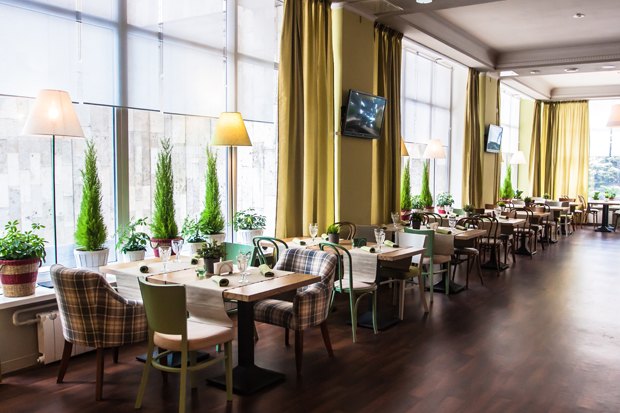
Identify the location of tables. The image size is (620, 413). (257, 282), (384, 252), (458, 224), (503, 218), (534, 208), (557, 204), (601, 198).